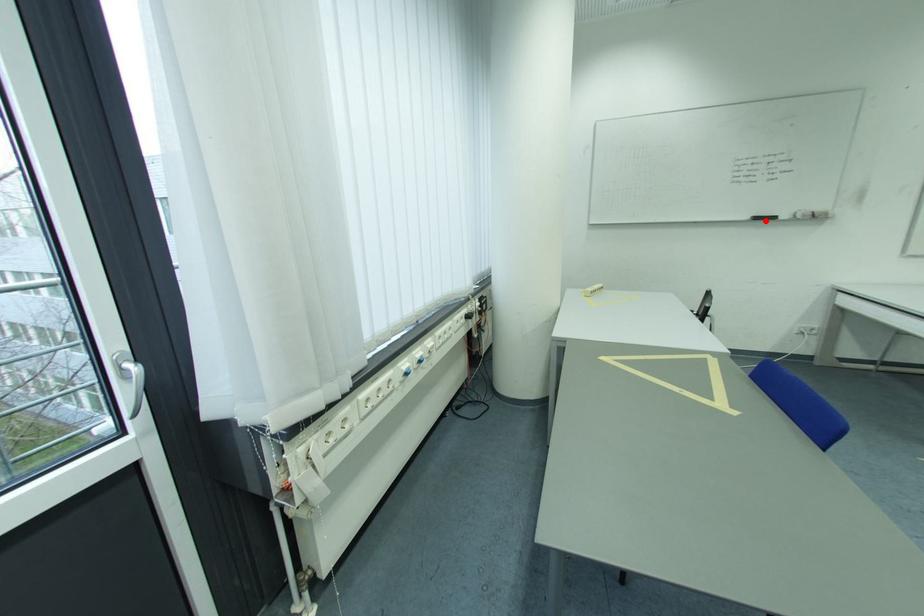
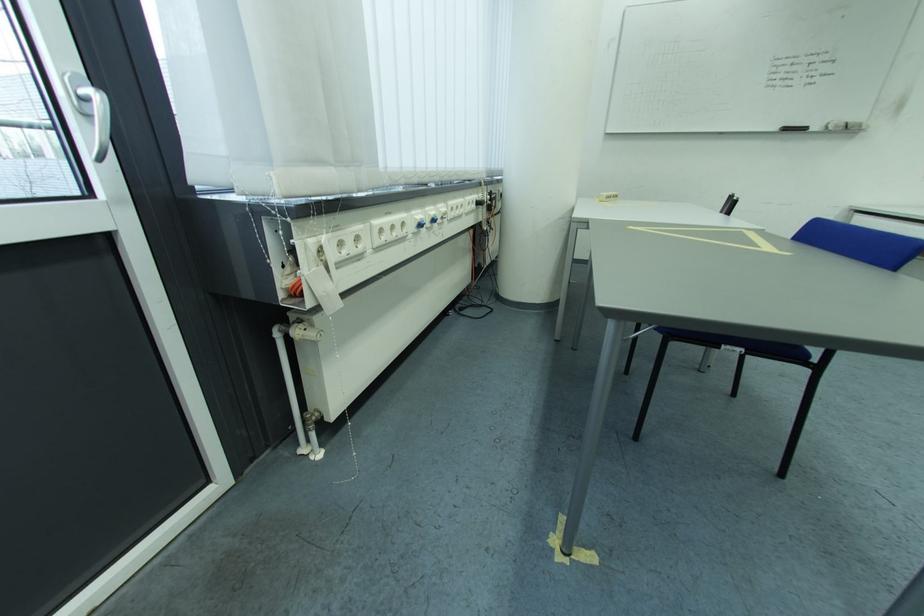
Question: I am providing you with two images of the same scene from different viewpoints. Given a red point in image1, look at the same physical point in image2. Is it:

Choices:
 (A) Closer to the viewpoint
 (B) Farther from the viewpoint

Answer: (B)